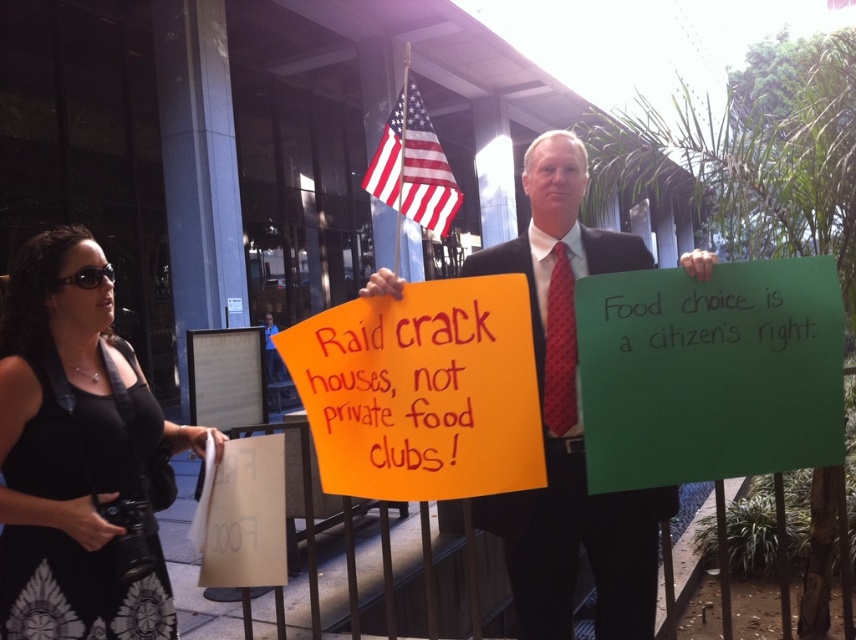
Can you confirm if black dress at left is positioned above matte orange sign at center?

No.

Between point (24, 340) and point (571, 513), which one is positioned behind?

Point (571, 513)

What do you see at coordinates (73, 452) in the screenshot? I see `black dress at left` at bounding box center [73, 452].

Locate an element on the screen. The image size is (856, 640). black dress at left is located at coordinates [73, 452].

Find the location of a particular element. The image size is (856, 640). green paper sign at center is located at coordinates (710, 372).

Which is behind, point (449, 280) or point (568, 282)?

Point (568, 282)

Who is higher up, orange paper sign at center or matte orange sign at center?

orange paper sign at center

Is point (325, 356) closer to camera compared to point (563, 429)?

No, (325, 356) is behind (563, 429).

Locate an element on the screen. The image size is (856, 640). orange paper sign at center is located at coordinates (421, 392).